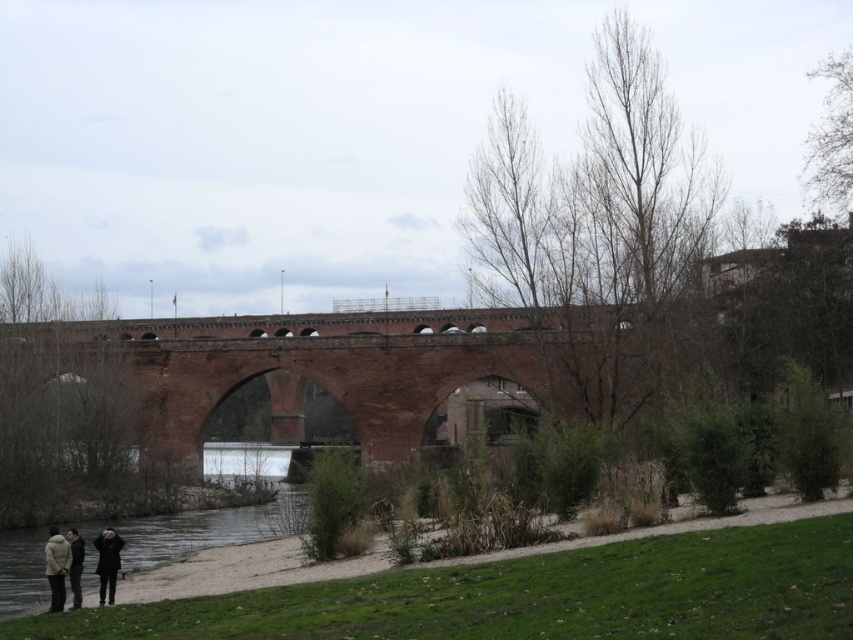
Question: Which point is closer to the camera?

Choices:
 (A) (49, 556)
 (B) (105, 552)

Answer: (A)

Question: Can you confirm if red brick bridge at center is wider than dark gray coat at lower left?

Choices:
 (A) yes
 (B) no

Answer: (A)

Question: Among these objects, which one is nearest to the camera?

Choices:
 (A) dark gray coat at lower left
 (B) dark gray sweater at lower left

Answer: (B)

Question: Is beige wool coat at lower left further to camera compared to dark gray coat at lower left?

Choices:
 (A) yes
 (B) no

Answer: (B)

Question: Which object appears closest to the camera in this image?

Choices:
 (A) beige wool coat at lower left
 (B) red brick bridge at center

Answer: (A)

Question: Does dark brown leather jacket at lower left appear over beige wool coat at lower left?

Choices:
 (A) no
 (B) yes

Answer: (B)